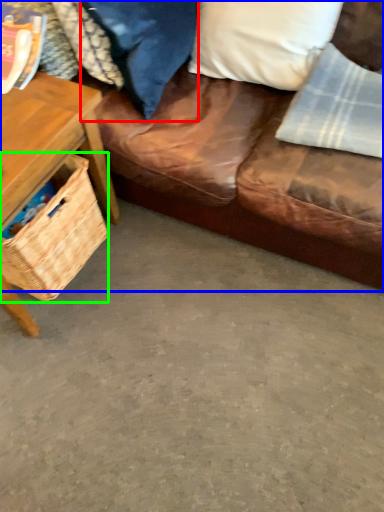
Question: Estimate the real-world distances between objects in this image. Which object is farther from pillow (highlighted by a red box), studio couch (highlighted by a blue box) or picnic basket (highlighted by a green box)?

Choices:
 (A) studio couch
 (B) picnic basket

Answer: (B)